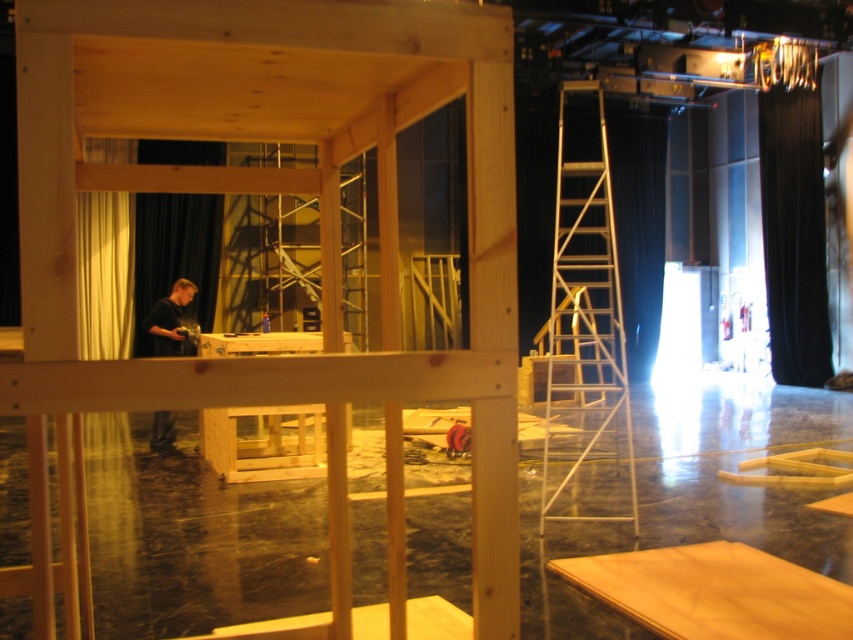
Based on the photo, does black velvet curtain at right appear on the left side of dark brown wood man at left?

No, black velvet curtain at right is not to the left of dark brown wood man at left.

Is point (775, 260) farther from camera compared to point (152, 340)?

Yes.

Identify the location of black velvet curtain at right. (793, 234).

Is silver metallic ladder at right to the right of black velvet curtain at right from the viewer's perspective?

In fact, silver metallic ladder at right is to the left of black velvet curtain at right.

What do you see at coordinates (584, 321) in the screenshot? I see `silver metallic ladder at right` at bounding box center [584, 321].

Between point (595, 477) and point (816, 145), which one is positioned in front?

Positioned in front is point (595, 477).

You are a GUI agent. You are given a task and a screenshot of the screen. Output one action in this format:
    pyautogui.click(x=<x>, y=<y>)
    Task: Click on the silver metallic ladder at right
    The image size is (853, 640).
    Given the screenshot: What is the action you would take?
    pyautogui.click(x=584, y=321)

Which is more to the left, silver metallic ladder at right or dark brown wood man at left?

Positioned to the left is dark brown wood man at left.

Is point (569, 157) positioned before point (154, 428)?

No, (569, 157) is behind (154, 428).

This screenshot has width=853, height=640. I want to click on silver metallic ladder at right, so click(584, 321).